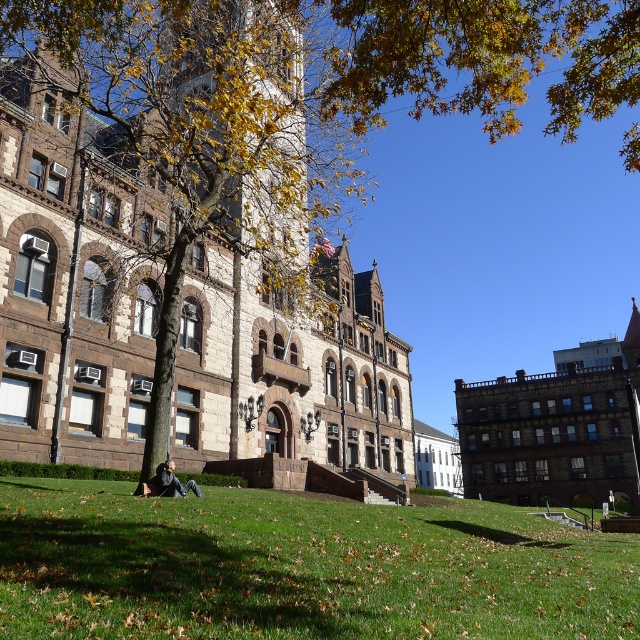
Question: Where is green grass at lower center located in relation to light brown hair at lower center in the image?

Choices:
 (A) below
 (B) above

Answer: (A)

Question: Among these objects, which one is farthest from the camera?

Choices:
 (A) light brown hair at lower center
 (B) green grass at lower center

Answer: (A)

Question: Can you confirm if green grass at lower center is smaller than light brown hair at lower center?

Choices:
 (A) yes
 (B) no

Answer: (B)

Question: Which of the following is the farthest from the observer?

Choices:
 (A) (x=240, y=584)
 (B) (x=193, y=481)

Answer: (B)

Question: Which point appears farthest from the camera in this image?

Choices:
 (A) (150, 580)
 (B) (173, 483)

Answer: (B)

Question: Can you confirm if green grass at lower center is wider than light brown hair at lower center?

Choices:
 (A) yes
 (B) no

Answer: (A)